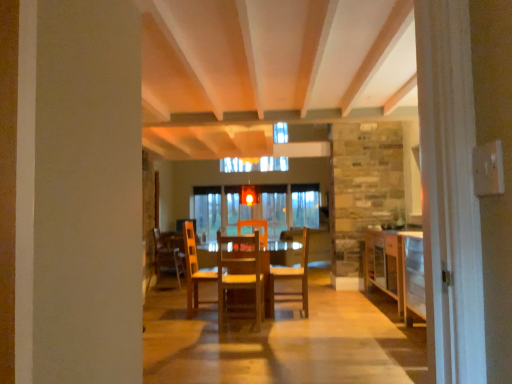
Question: Is wooden table at center looking in the opposite direction of wooden chair at center, the second chair in the right-to-left sequence?

Choices:
 (A) no
 (B) yes

Answer: (B)

Question: Is wooden table at center far away from wooden chair at center, the 3th chair when ordered from back to front?

Choices:
 (A) yes
 (B) no

Answer: (B)

Question: Considering the relative sizes of wooden table at center and wooden chair at center, the second chair in the right-to-left sequence, in the image provided, is wooden table at center bigger than wooden chair at center, the second chair in the right-to-left sequence,?

Choices:
 (A) yes
 (B) no

Answer: (A)

Question: Considering the relative sizes of wooden table at center and wooden chair at center, the 3th chair when ordered from back to front, in the image provided, is wooden table at center thinner than wooden chair at center, the 3th chair when ordered from back to front,?

Choices:
 (A) yes
 (B) no

Answer: (B)

Question: From the image's perspective, would you say wooden table at center is positioned over wooden chair at center, the second chair in the right-to-left sequence?

Choices:
 (A) yes
 (B) no

Answer: (B)

Question: Based on their positions, is wooden chair at center, which appears as the third chair when viewed from the left, located to the left or right of wooden table at center?

Choices:
 (A) left
 (B) right

Answer: (B)

Question: From the image's perspective, is wooden chair at center, which appears as the first chair when viewed from the right, positioned above or below wooden table at center?

Choices:
 (A) above
 (B) below

Answer: (A)

Question: Based on their sizes in the image, would you say wooden chair at center, which appears as the first chair when viewed from the right, is bigger or smaller than wooden table at center?

Choices:
 (A) small
 (B) big

Answer: (A)

Question: Considering the positions of point (297, 294) and point (271, 246), is point (297, 294) closer or farther from the camera than point (271, 246)?

Choices:
 (A) farther
 (B) closer

Answer: (B)

Question: Which is correct: wooden chair at center, which ranks as the second chair in left-to-right order, is inside wooden chair at center, marked as the 1th chair in a left-to-right arrangement, or outside of it?

Choices:
 (A) inside
 (B) outside

Answer: (B)

Question: In the image, is wooden chair at center, the second chair in the right-to-left sequence, positioned in front of or behind wooden chair at center, which is the 1th chair in back-to-front order?

Choices:
 (A) behind
 (B) front

Answer: (B)

Question: From the image's perspective, is wooden chair at center, which ranks as the second chair in left-to-right order, positioned above or below wooden chair at center, marked as the 1th chair in a left-to-right arrangement?

Choices:
 (A) below
 (B) above

Answer: (B)

Question: Is wooden chair at center, the 1th chair positioned from the front, taller or shorter than wooden chair at center, which is the 3th chair from right to left?

Choices:
 (A) short
 (B) tall

Answer: (B)

Question: In the image, is wooden cabinet at right positioned in front of or behind wooden chair at center, which appears as the first chair when viewed from the right?

Choices:
 (A) behind
 (B) front

Answer: (B)

Question: From the image's perspective, is wooden cabinet at right above or below wooden chair at center, which appears as the third chair when viewed from the left?

Choices:
 (A) above
 (B) below

Answer: (B)